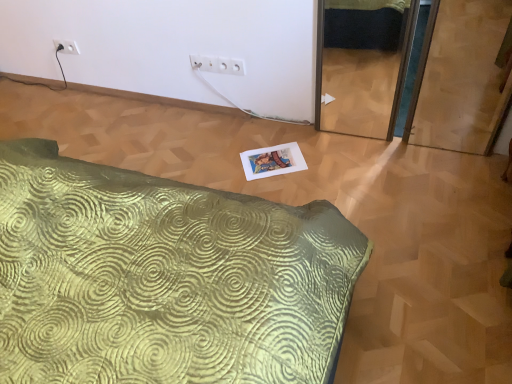
In order to face white plastic outlet at upper center, acting as the first electric outlet starting from the bottom, should I rotate leftwards or rightwards?

You should rotate left by 5.101 degrees.

Find the location of `white plastic electric outlet at upper left, arranged as the 2th electric outlet when ordered from the bottom`. white plastic electric outlet at upper left, arranged as the 2th electric outlet when ordered from the bottom is located at coordinates (66, 46).

What do you see at coordinates (164, 278) in the screenshot? This screenshot has width=512, height=384. I see `green textured bed at lower left` at bounding box center [164, 278].

Locate an element on the screen. The height and width of the screenshot is (384, 512). white plastic outlet at upper center, the first electric outlet viewed from the front is located at coordinates (218, 65).

Is green textured bed at lower left bigger or smaller than white plastic electric outlet at upper left, the second electric outlet viewed from the front?

In the image, green textured bed at lower left appears to be larger than white plastic electric outlet at upper left, the second electric outlet viewed from the front.

Which is in front, green textured bed at lower left or white plastic electric outlet at upper left, placed as the 1th electric outlet when sorted from left to right?

Positioned in front is green textured bed at lower left.

Is green textured bed at lower left aimed at white plastic electric outlet at upper left, arranged as the 2th electric outlet when ordered from the bottom?

No, green textured bed at lower left is not facing towards white plastic electric outlet at upper left, arranged as the 2th electric outlet when ordered from the bottom.

Who is shorter, white plastic outlet at upper center, which appears as the 1th electric outlet when viewed from the right, or white plastic electric outlet at upper left, placed as the first electric outlet when sorted from back to front?

Standing shorter between the two is white plastic outlet at upper center, which appears as the 1th electric outlet when viewed from the right.

Is white plastic outlet at upper center, acting as the first electric outlet starting from the bottom, looking in the opposite direction of white plastic electric outlet at upper left, positioned as the 1th electric outlet in top-to-bottom order?

No, white plastic outlet at upper center, acting as the first electric outlet starting from the bottom, is not facing the opposite direction of white plastic electric outlet at upper left, positioned as the 1th electric outlet in top-to-bottom order.

Considering the points (209, 58) and (72, 51), which point is behind, point (209, 58) or point (72, 51)?

Positioned behind is point (72, 51).

Does white plastic electric outlet at upper left, the second electric outlet viewed from the front, appear on the right side of green textured bed at lower left?

Incorrect, white plastic electric outlet at upper left, the second electric outlet viewed from the front, is not on the right side of green textured bed at lower left.

Is white plastic electric outlet at upper left, placed as the first electric outlet when sorted from back to front, beside green textured bed at lower left?

No, white plastic electric outlet at upper left, placed as the first electric outlet when sorted from back to front, is not in contact with green textured bed at lower left.

Is point (64, 40) behind point (111, 246)?

Yes, point (64, 40) is behind point (111, 246).

This screenshot has width=512, height=384. Identify the location of bed below the white plastic electric outlet at upper left, placed as the first electric outlet when sorted from back to front (from the image's perspective). (164, 278).

Which object is further away from the camera taking this photo, green textured bed at lower left or white plastic outlet at upper center, acting as the first electric outlet starting from the bottom?

white plastic outlet at upper center, acting as the first electric outlet starting from the bottom, is further away from the camera.

From a real-world perspective, which object rests below the other?

In real-world perspective, green textured bed at lower left is lower.

Based on the photo, can you confirm if green textured bed at lower left is positioned to the right of white plastic outlet at upper center, acting as the first electric outlet starting from the bottom?

Incorrect, green textured bed at lower left is not on the right side of white plastic outlet at upper center, acting as the first electric outlet starting from the bottom.

Is green textured bed at lower left positioned with its back to white plastic outlet at upper center, the second electric outlet in the back-to-front sequence?

green textured bed at lower left does not have its back to white plastic outlet at upper center, the second electric outlet in the back-to-front sequence.

Locate an element on the screen. The height and width of the screenshot is (384, 512). electric outlet on the right of the white plastic electric outlet at upper left, placed as the 1th electric outlet when sorted from left to right is located at coordinates (218, 65).

Is white plastic electric outlet at upper left, placed as the 1th electric outlet when sorted from left to right, inside or outside of white plastic outlet at upper center, which appears as the 1th electric outlet when viewed from the right?

white plastic electric outlet at upper left, placed as the 1th electric outlet when sorted from left to right, is not enclosed by white plastic outlet at upper center, which appears as the 1th electric outlet when viewed from the right.

From a real-world perspective, between white plastic electric outlet at upper left, the second electric outlet viewed from the front, and white plastic outlet at upper center, the second electric outlet in the back-to-front sequence, who is vertically higher?

white plastic outlet at upper center, the second electric outlet in the back-to-front sequence, from a real-world perspective.

Considering the positions of objects white plastic electric outlet at upper left, placed as the first electric outlet when sorted from back to front, and white plastic outlet at upper center, which appears as the 1th electric outlet when viewed from the right, in the image provided, who is in front, white plastic electric outlet at upper left, placed as the first electric outlet when sorted from back to front, or white plastic outlet at upper center, which appears as the 1th electric outlet when viewed from the right,?

white plastic outlet at upper center, which appears as the 1th electric outlet when viewed from the right, is closer to the camera.

Is white plastic outlet at upper center, which ranks as the 2th electric outlet in left-to-right order, turned away from green textured bed at lower left?

No, white plastic outlet at upper center, which ranks as the 2th electric outlet in left-to-right order,'s orientation is not away from green textured bed at lower left.

Relative to green textured bed at lower left, is white plastic outlet at upper center, which ranks as the 2th electric outlet in left-to-right order, in front or behind?

white plastic outlet at upper center, which ranks as the 2th electric outlet in left-to-right order, is positioned farther from the viewer than green textured bed at lower left.

From the image's perspective, which one is positioned lower, white plastic outlet at upper center, acting as the first electric outlet starting from the bottom, or green textured bed at lower left?

green textured bed at lower left, from the image's perspective.

Is white plastic outlet at upper center, which ranks as the 2th electric outlet in left-to-right order, not close to green textured bed at lower left?

Yes, white plastic outlet at upper center, which ranks as the 2th electric outlet in left-to-right order, and green textured bed at lower left are located far from each other.

This screenshot has width=512, height=384. I want to click on electric outlet to the left of green textured bed at lower left, so click(x=66, y=46).

Image resolution: width=512 pixels, height=384 pixels. Identify the location of electric outlet above the white plastic electric outlet at upper left, positioned as the 1th electric outlet in top-to-bottom order (from a real-world perspective). (218, 65).

Based on the photo, from the image, which object appears to be farther from white plastic outlet at upper center, which ranks as the 2th electric outlet in left-to-right order, green textured bed at lower left or white plastic electric outlet at upper left, positioned as the 1th electric outlet in top-to-bottom order?

green textured bed at lower left is positioned further to the anchor white plastic outlet at upper center, which ranks as the 2th electric outlet in left-to-right order.

Based on the photo, considering their positions, is white plastic electric outlet at upper left, the second electric outlet viewed from the front, positioned closer to green textured bed at lower left than white plastic outlet at upper center, the 2th electric outlet from the top?

white plastic outlet at upper center, the 2th electric outlet from the top, is closer to green textured bed at lower left.

Estimate the real-world distances between objects in this image. Which object is closer to white plastic electric outlet at upper left, placed as the first electric outlet when sorted from back to front, green textured bed at lower left or white plastic outlet at upper center, the second electric outlet in the back-to-front sequence?

Among the two, white plastic outlet at upper center, the second electric outlet in the back-to-front sequence, is located nearer to white plastic electric outlet at upper left, placed as the first electric outlet when sorted from back to front.

From the image, which object appears to be nearer to green textured bed at lower left, white plastic outlet at upper center, the second electric outlet in the back-to-front sequence, or white plastic electric outlet at upper left, arranged as the 2th electric outlet when ordered from the bottom?

white plastic outlet at upper center, the second electric outlet in the back-to-front sequence, is positioned closer to the anchor green textured bed at lower left.

From the image, which object appears to be nearer to white plastic outlet at upper center, which appears as the 1th electric outlet when viewed from the right, white plastic electric outlet at upper left, the second electric outlet positioned from the right, or green textured bed at lower left?

white plastic electric outlet at upper left, the second electric outlet positioned from the right, is positioned closer to the anchor white plastic outlet at upper center, which appears as the 1th electric outlet when viewed from the right.

Based on their spatial positions, is white plastic outlet at upper center, acting as the first electric outlet starting from the bottom, or green textured bed at lower left further from white plastic electric outlet at upper left, placed as the first electric outlet when sorted from back to front?

green textured bed at lower left lies further to white plastic electric outlet at upper left, placed as the first electric outlet when sorted from back to front, than the other object.

The image size is (512, 384). Identify the location of electric outlet positioned between green textured bed at lower left and white plastic electric outlet at upper left, placed as the first electric outlet when sorted from back to front, from near to far. (218, 65).